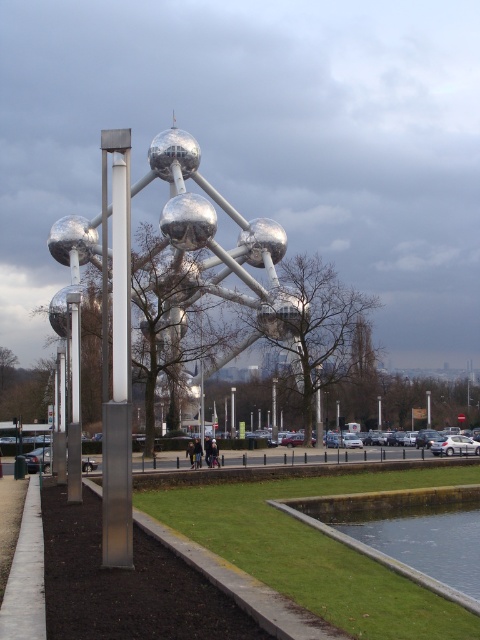
Question: Which object is the farthest from the silver polished pole at left?

Choices:
 (A) silver metallic pole at center
 (B) clear water at lower center

Answer: (A)

Question: Can you confirm if silver polished pole at left is positioned above clear water at lower center?

Choices:
 (A) yes
 (B) no

Answer: (A)

Question: Which object is positioned closest to the clear water at lower center?

Choices:
 (A) silver metallic pole at center
 (B) silver polished pole at left

Answer: (B)

Question: Does clear water at lower center appear under silver metallic pole at center?

Choices:
 (A) no
 (B) yes

Answer: (B)

Question: Which point is farther to the camera?

Choices:
 (A) (439, 582)
 (B) (71, 339)
 (C) (122, 173)

Answer: (B)

Question: Does silver polished pole at left appear under silver metallic pole at center?

Choices:
 (A) yes
 (B) no

Answer: (A)